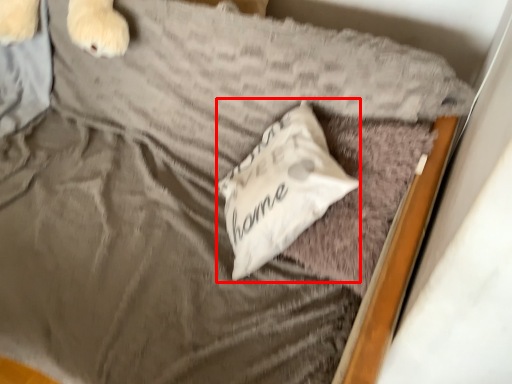
Question: From the image's perspective, where is pillow (annotated by the red box) located in relation to pillow in the image?

Choices:
 (A) above
 (B) below

Answer: (A)